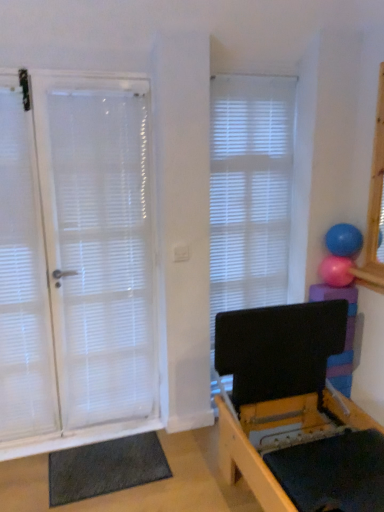
Question: Is blue rubber ball at upper right, acting as the 1th ball starting from the top, wider than dark gray textured yoga mat at lower left?

Choices:
 (A) yes
 (B) no

Answer: (B)

Question: From a real-world perspective, is blue rubber ball at upper right, acting as the 1th ball starting from the top, positioned under dark gray textured yoga mat at lower left based on gravity?

Choices:
 (A) yes
 (B) no

Answer: (B)

Question: Is blue rubber ball at upper right, positioned as the 2th ball in bottom-to-top order, beside dark gray textured yoga mat at lower left?

Choices:
 (A) no
 (B) yes

Answer: (A)

Question: Can we say blue rubber ball at upper right, acting as the 1th ball starting from the top, lies outside dark gray textured yoga mat at lower left?

Choices:
 (A) no
 (B) yes

Answer: (B)

Question: Is there a large distance between blue rubber ball at upper right, acting as the 1th ball starting from the top, and dark gray textured yoga mat at lower left?

Choices:
 (A) no
 (B) yes

Answer: (B)

Question: Is blue rubber ball at upper right, acting as the 1th ball starting from the top, positioned in front of dark gray textured yoga mat at lower left?

Choices:
 (A) yes
 (B) no

Answer: (B)

Question: Considering the relative sizes of white sheer curtain at left and white matte door at left in the image provided, is white sheer curtain at left thinner than white matte door at left?

Choices:
 (A) yes
 (B) no

Answer: (B)

Question: From the image's perspective, is white sheer curtain at left located beneath white matte door at left?

Choices:
 (A) yes
 (B) no

Answer: (A)

Question: Can you confirm if white sheer curtain at left is bigger than white matte door at left?

Choices:
 (A) no
 (B) yes

Answer: (A)

Question: Considering the relative sizes of white sheer curtain at left and white matte door at left in the image provided, is white sheer curtain at left taller than white matte door at left?

Choices:
 (A) yes
 (B) no

Answer: (B)

Question: From the image's perspective, is white sheer curtain at left located above white matte door at left?

Choices:
 (A) no
 (B) yes

Answer: (A)

Question: Is white sheer curtain at left at the right side of white matte door at left?

Choices:
 (A) yes
 (B) no

Answer: (B)

Question: Can you confirm if white matte window blind at center is shorter than dark gray textured yoga mat at lower left?

Choices:
 (A) yes
 (B) no

Answer: (B)